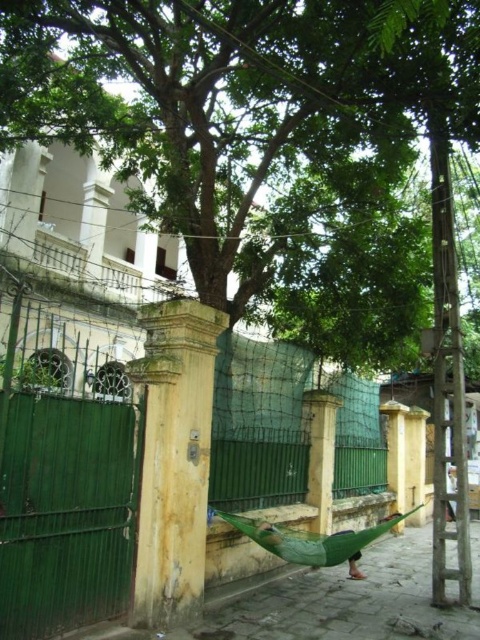
Is green leafy tree at center smaller than green metal fence at center?

No, green leafy tree at center is not smaller than green metal fence at center.

From the picture: Can you confirm if green leafy tree at center is shorter than green metal fence at center?

In fact, green leafy tree at center may be taller than green metal fence at center.

This screenshot has width=480, height=640. Find the location of `green leafy tree at center`. green leafy tree at center is located at coordinates (264, 140).